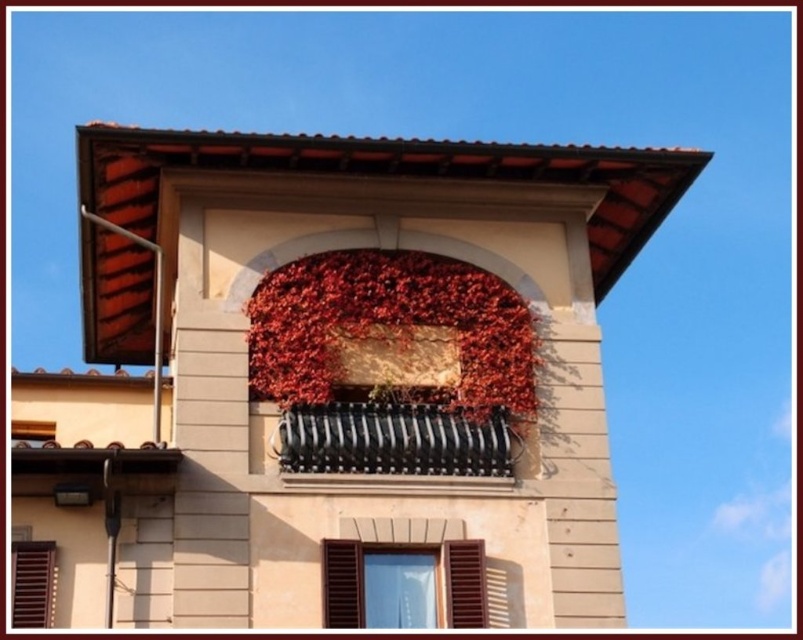
Which is behind, point (389, 292) or point (84, 497)?

The point (389, 292) is more distant.

Who is more forward, [349,260] or [60,493]?

Point [60,493] is in front.

Locate an element on the screen. dried red leaves at center is located at coordinates (389, 326).

Can you confirm if black metal railing at center is thinner than matte brown shutter at lower center?

Incorrect, black metal railing at center's width is not less than matte brown shutter at lower center's.

Which is below, black metal railing at center or matte brown shutter at lower center?

Positioned lower is matte brown shutter at lower center.

Where is `black metal railing at center`? The width and height of the screenshot is (803, 640). black metal railing at center is located at coordinates (392, 440).

Can you confirm if black metal railing at center is positioned to the left of brown wooden shutter at lower left?

In fact, black metal railing at center is to the right of brown wooden shutter at lower left.

Is black metal railing at center smaller than brown wooden shutter at lower left?

Actually, black metal railing at center might be larger than brown wooden shutter at lower left.

Is point (450, 419) in front of point (25, 625)?

No, (450, 419) is further to viewer.

You are a GUI agent. You are given a task and a screenshot of the screen. Output one action in this format:
    pyautogui.click(x=<x>, y=<y>)
    Task: Click on the black metal railing at center
    This screenshot has width=803, height=640.
    Given the screenshot: What is the action you would take?
    pyautogui.click(x=392, y=440)